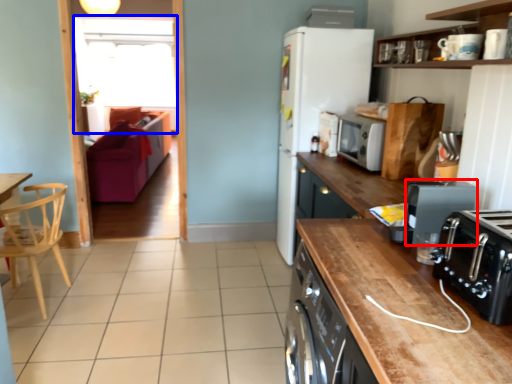
Question: Which object is further to the camera taking this photo, kitchen appliance (highlighted by a red box) or window screen (highlighted by a blue box)?

Choices:
 (A) kitchen appliance
 (B) window screen

Answer: (B)